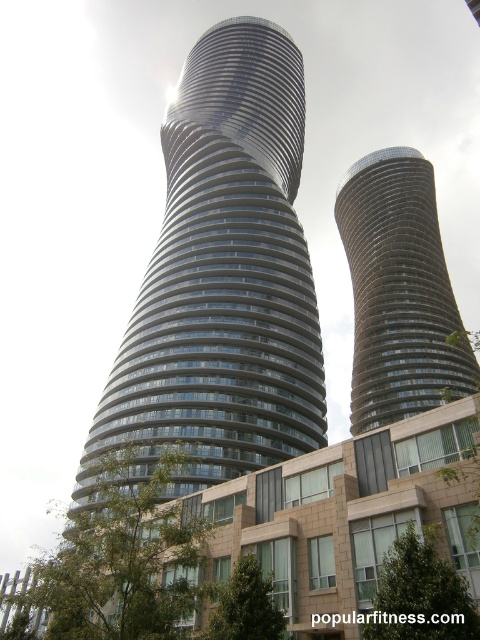
Question: Does glassy steel tower at center have a larger size compared to glassy metallic tower at center?

Choices:
 (A) yes
 (B) no

Answer: (A)

Question: Can you confirm if glassy steel tower at center is thinner than glassy metallic tower at center?

Choices:
 (A) no
 (B) yes

Answer: (B)

Question: Which point is closer to the camera?

Choices:
 (A) (287, 372)
 (B) (377, 353)

Answer: (A)

Question: Can you confirm if glassy steel tower at center is wider than glassy metallic tower at center?

Choices:
 (A) yes
 (B) no

Answer: (B)

Question: Which object appears closest to the camera in this image?

Choices:
 (A) glassy steel tower at center
 (B) glassy metallic tower at center

Answer: (A)